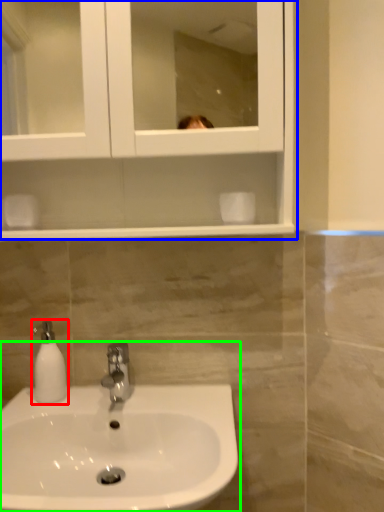
Question: Based on their relative distances, which object is nearer to soap dispenser (highlighted by a red box)? Choose from medicine cabinet (highlighted by a blue box) and sink (highlighted by a green box).

Choices:
 (A) medicine cabinet
 (B) sink

Answer: (B)